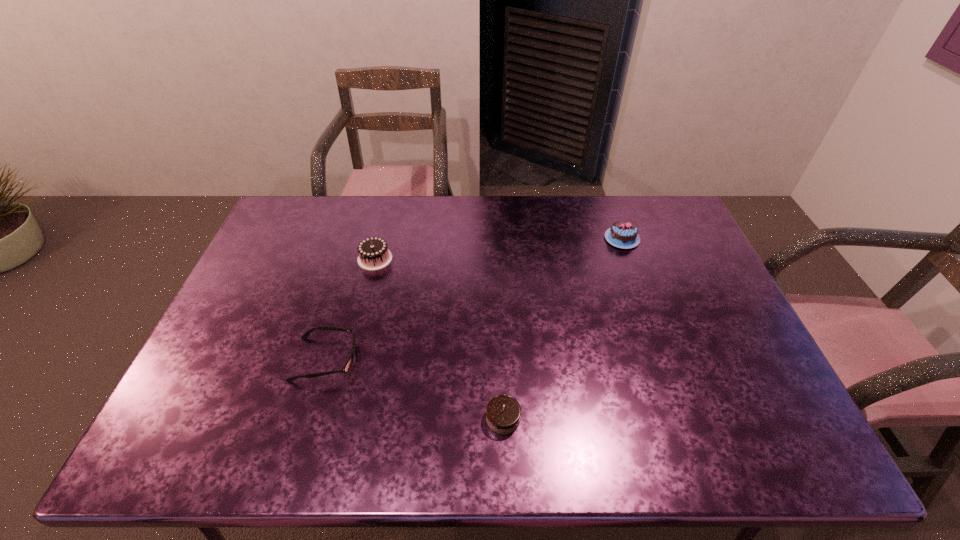
Find the location of a particular element. object that stands as the closest to the second chocolate cake from left to right is located at coordinates (348, 364).

Point out which chocolate cake is positioned as the second nearest to the tallest chocolate cake. Please provide its 2D coordinates. Your answer should be formatted as a tuple, i.e. [(x, y)], where the tuple contains the x and y coordinates of a point satisfying the conditions above.

[(622, 234)]

You are a GUI agent. You are given a task and a screenshot of the screen. Output one action in this format:
    pyautogui.click(x=<x>, y=<y>)
    Task: Click on the chocolate cake that is the closest one to the third object from left to right
    Image resolution: width=960 pixels, height=540 pixels.
    Given the screenshot: What is the action you would take?
    pos(373,252)

The height and width of the screenshot is (540, 960). I want to click on free region that satisfies the following two spatial constraints: 1. on the front side of the rightmost chocolate cake; 2. on the front-facing side of the spectacles, so click(664, 359).

This screenshot has height=540, width=960. I want to click on vacant position in the image that satisfies the following two spatial constraints: 1. on the front side of the tallest object; 2. on the front-facing side of the spectacles, so click(x=350, y=359).

This screenshot has height=540, width=960. I want to click on vacant space that satisfies the following two spatial constraints: 1. on the front side of the tallest object; 2. on the front-facing side of the spectacles, so click(350, 359).

Find the location of `vacant point that satisfies the following two spatial constraints: 1. on the back side of the second chocolate cake from left to right; 2. on the front-facing side of the spectacles`. vacant point that satisfies the following two spatial constraints: 1. on the back side of the second chocolate cake from left to right; 2. on the front-facing side of the spectacles is located at coordinates (501, 359).

Find the location of a particular element. free spot that satisfies the following two spatial constraints: 1. on the front side of the nearest chocolate cake; 2. on the left side of the tallest object is located at coordinates (335, 418).

The image size is (960, 540). What are the coordinates of `vacant region that satisfies the following two spatial constraints: 1. on the front side of the tallest chocolate cake; 2. on the front-facing side of the shortest object` in the screenshot? It's located at coord(350,359).

I want to click on vacant area in the image that satisfies the following two spatial constraints: 1. on the back side of the nearest object; 2. on the right side of the rightmost chocolate cake, so click(496, 239).